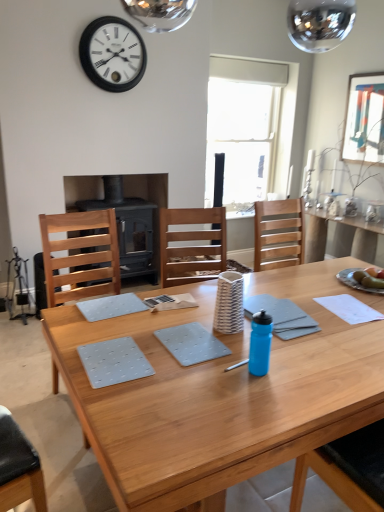
Question: Is green matte apple at center taller or shorter than gray matte notebook at center?

Choices:
 (A) tall
 (B) short

Answer: (A)

Question: Visually, is green matte apple at center positioned to the left or to the right of gray matte notebook at center?

Choices:
 (A) left
 (B) right

Answer: (B)

Question: Which object is the farthest from the light gray fabric placemat at center, which is counted as the 2th place mat, starting from the front?

Choices:
 (A) wooden table at center
 (B) green matte apple at center
 (C) gray matte placemat at center, which is the 2th place mat from back to front
 (D) blue plastic water bottle at center
 (E) matte white picture frame at upper right

Answer: (E)

Question: Which object is the farthest from the gray matte notebook at center?

Choices:
 (A) light wood chair at left
 (B) wooden table at center
 (C) matte white picture frame at upper right
 (D) white matte wall clock at upper center
 (E) blue plastic water bottle at center

Answer: (C)